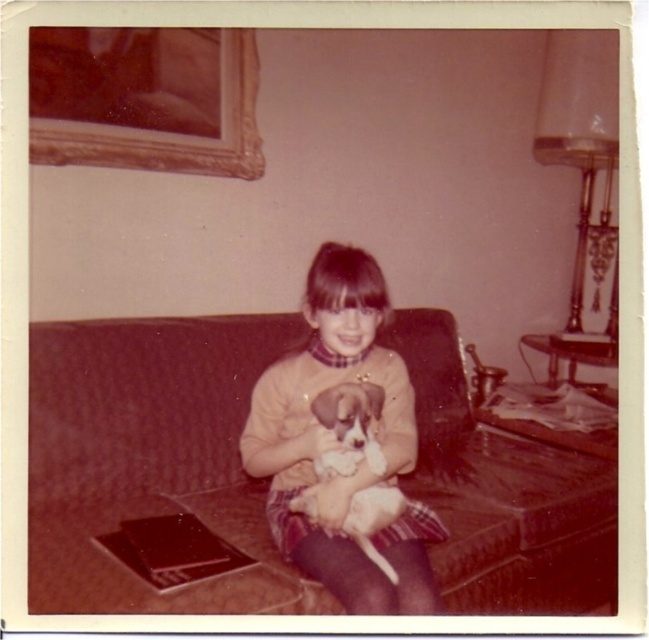
You are an interior designer assessing the layout of this living room. The brown fabric couch at center and the goldwooden frame at upper left are both in view. Which object occupies more horizontal space in the image?

The brown fabric couch at center occupies more horizontal space than the goldwooden frame at upper left because its width surpasses the frame.

You are an interior designer assessing the living room layout. The brown fabric couch at center and the white fur dog at center are both in the room. Which object occupies more horizontal space in the image?

The brown fabric couch at center has a greater width than the white fur dog at center, so the brown fabric couch at center occupies more horizontal space in the image.